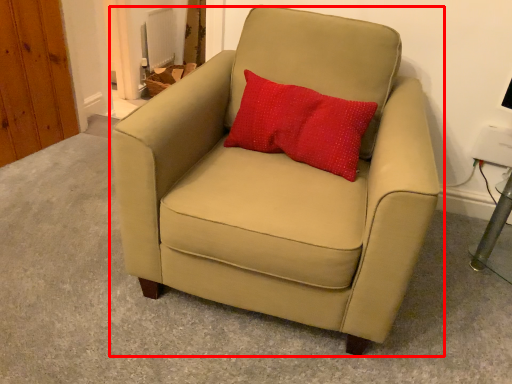
Question: Considering the relative positions of chair (annotated by the red box) and pillow in the image provided, where is chair (annotated by the red box) located with respect to the staircase?

Choices:
 (A) left
 (B) right

Answer: (A)